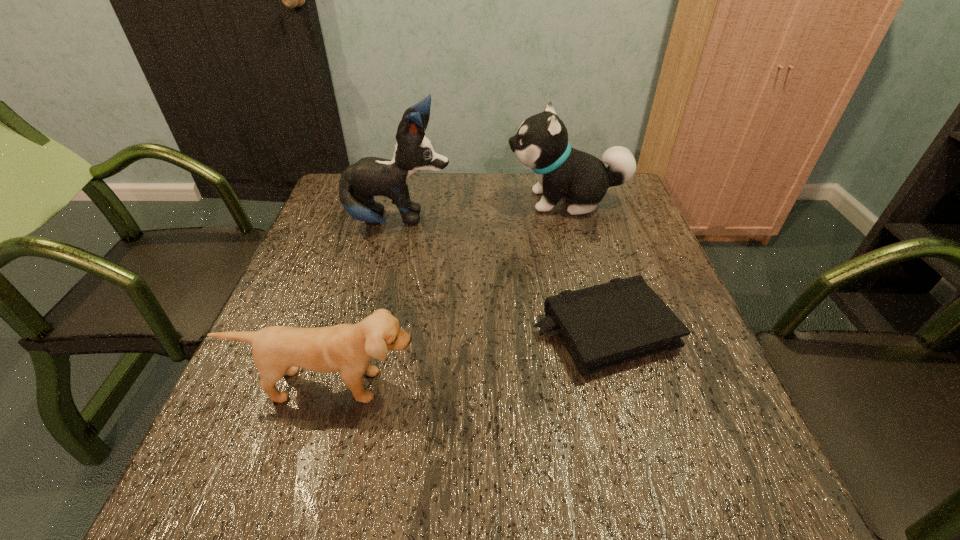
I want to click on free spot that satisfies the following two spatial constraints: 1. on the front-facing side of the tallest puppy; 2. on the left side of the second shortest object, so click(360, 385).

Locate an element on the screen. The image size is (960, 540). free spot that satisfies the following two spatial constraints: 1. at the face of the third shortest object; 2. on the left side of the shortest object is located at coordinates (601, 331).

Identify the location of vacant space that satisfies the following two spatial constraints: 1. at the face of the shortest object; 2. on the left side of the second shortest puppy. The height and width of the screenshot is (540, 960). (601, 331).

The width and height of the screenshot is (960, 540). Identify the location of vacant point that satisfies the following two spatial constraints: 1. at the face of the second tallest puppy; 2. on the right side of the Bible. point(601,331).